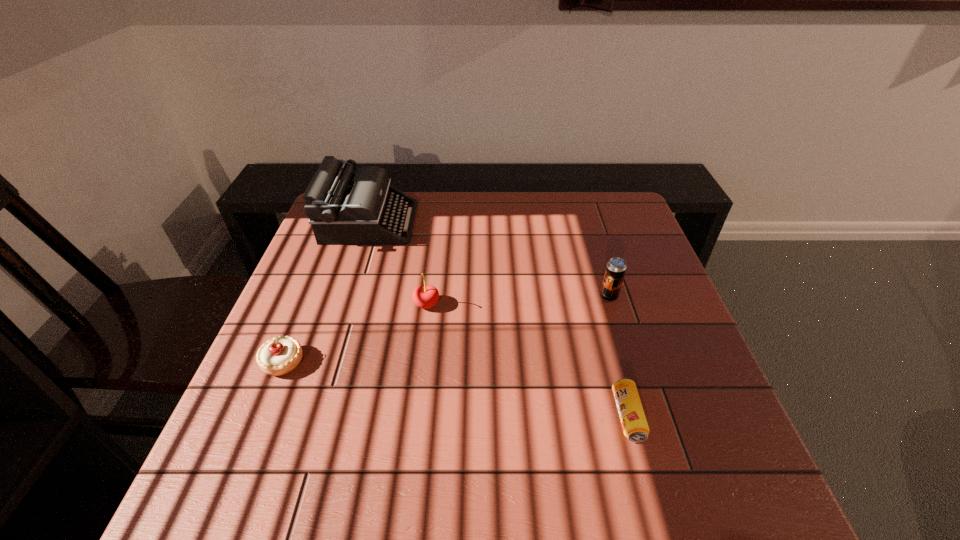
Locate an element on the screen. The image size is (960, 540). vacant space that satisfies the following two spatial constraints: 1. on the back side of the farther beer can; 2. on the left side of the fourth tallest object is located at coordinates (310, 296).

Find the location of a particular element. vacant space that satisfies the following two spatial constraints: 1. on the typing side of the typewriter; 2. on the left side of the nearest object is located at coordinates (307, 416).

Locate an element on the screen. free space in the image that satisfies the following two spatial constraints: 1. on the typing side of the cherry; 2. on the left side of the typewriter is located at coordinates (344, 304).